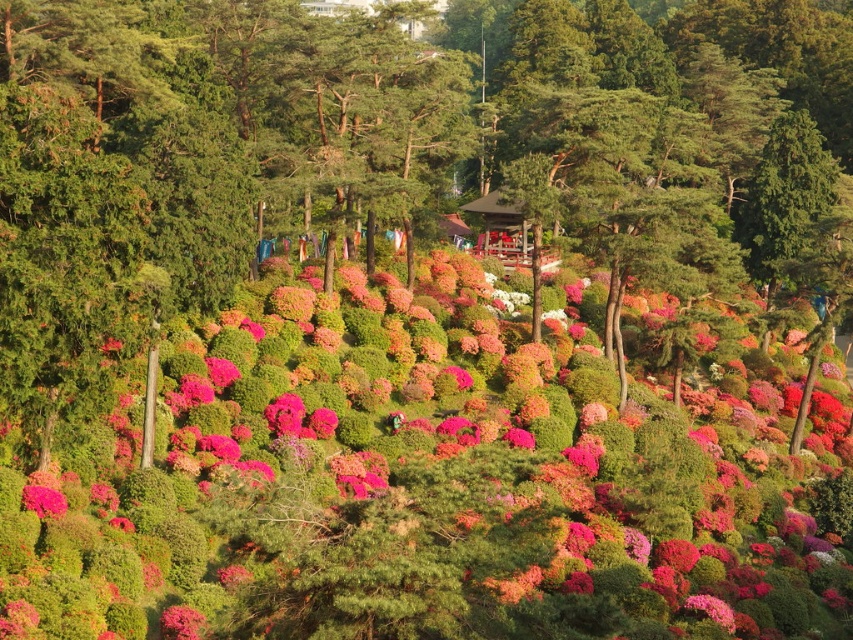
Question: Which point is closer to the camera taking this photo?

Choices:
 (A) (38, 497)
 (B) (184, 628)

Answer: (B)

Question: Among these points, which one is farthest from the camera?

Choices:
 (A) (201, 630)
 (B) (288, 413)
 (C) (33, 492)

Answer: (B)

Question: Is the position of pink matte bush at center less distant than that of pink matte flower at lower left?

Choices:
 (A) yes
 (B) no

Answer: (A)

Question: Which object is positioned closest to the pink matte bush at center?

Choices:
 (A) vivid pink petals at lower left
 (B) pink matte flower at lower left

Answer: (A)

Question: Is the position of pink matte bush at center less distant than that of vivid pink petals at lower left?

Choices:
 (A) yes
 (B) no

Answer: (A)

Question: Where is pink matte flower at lower left located in relation to vivid pink petals at lower left in the image?

Choices:
 (A) right
 (B) left

Answer: (A)